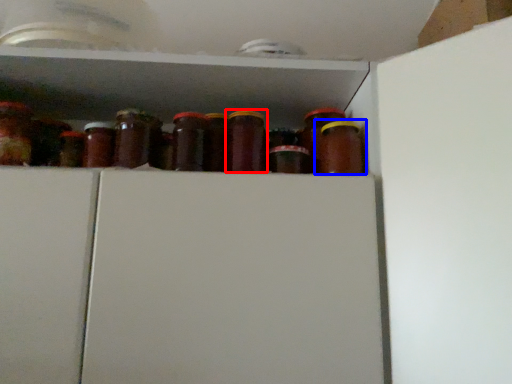
Question: Which point is further to the camera, bottle (highlighted by a red box) or bottle (highlighted by a blue box)?

Choices:
 (A) bottle
 (B) bottle

Answer: (B)